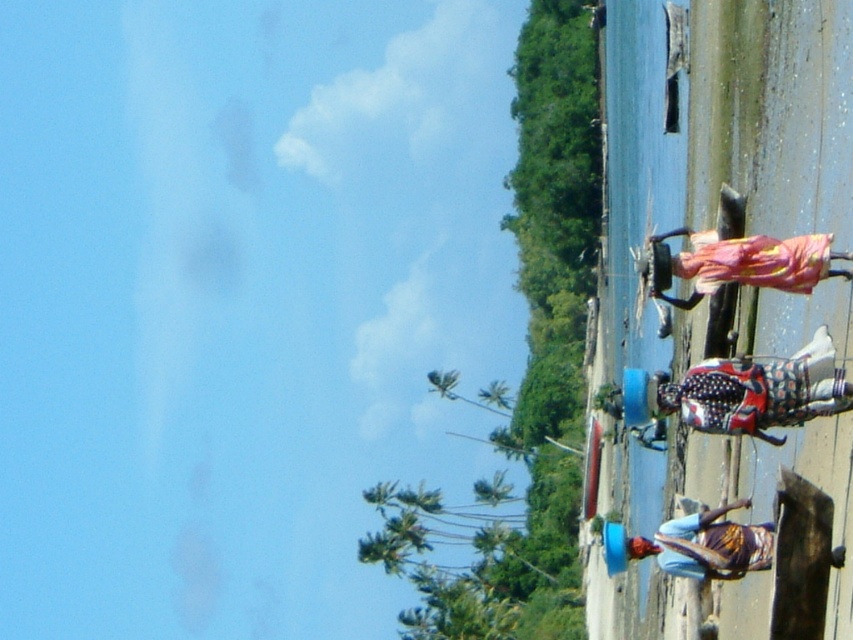
In the scene shown: You are a photographer trying to capture the polka dot fabric at center and the multicolored fabric at lower center in a single frame. Based on their positions, which fabric should you focus on first to ensure both are in the shot?

The polka dot fabric at center is shorter than the multicolored fabric at lower center, so you should focus on the multicolored fabric at lower center first to ensure both are in the shot.

You are a photographer trying to capture the polka dot fabric at center and the multicolored fabric at lower center in the same frame. Which fabric should you adjust your camera to focus on first if you want to include both in your shot?

The polka dot fabric at center is positioned on the right side of multicolored fabric at lower center, so you should focus on the multicolored fabric at lower center first as it is closer to the camera and allows framing both fabrics effectively.

You are standing at the shoreline in the coastal scene. You see two points marked on the sand. The first point is at coordinates point (763,428) and the second is at point (718,577). Which point is closer to your current position?

Point (763,428) is closer to the camera than point (718,577), so the first point is closer to your current position.